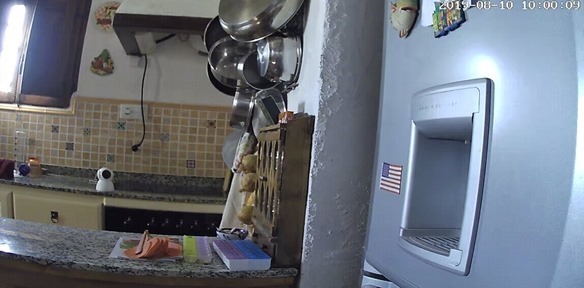
Find the location of `blue window curtains`. blue window curtains is located at coordinates (50, 37).